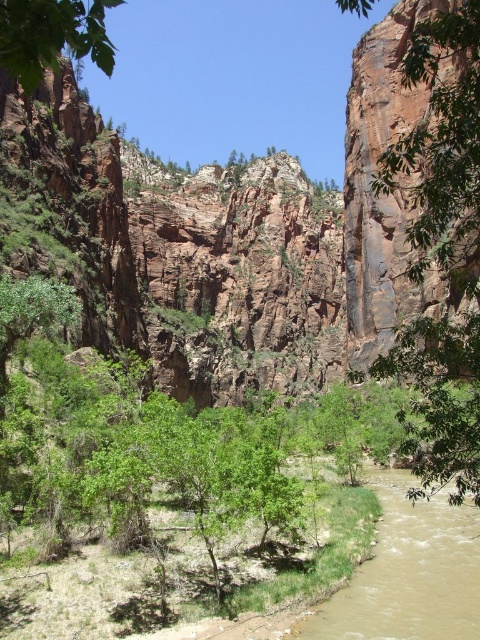
Is point (472, 358) farther from viewer compared to point (375, 592)?

That is False.

Can you confirm if green leafy tree at right is positioned to the right of brown muddy water at lower center?

Yes, green leafy tree at right is to the right of brown muddy water at lower center.

Is point (447, 234) farther from camera compared to point (397, 568)?

Yes, point (447, 234) is behind point (397, 568).

At what (x,y) coordinates should I click in order to perform the action: click on green leafy tree at right. Please return your answer as a coordinate pair (x, y). Looking at the image, I should click on (442, 252).

Is green leafy tree at right shorter than green leafy tree at upper left?

Correct, green leafy tree at right is not as tall as green leafy tree at upper left.

Where is `green leafy tree at right`? The image size is (480, 640). green leafy tree at right is located at coordinates (442, 252).

Which of these two, brown muddy water at lower center or green leafy tree at upper left, stands shorter?

With less height is brown muddy water at lower center.

This screenshot has width=480, height=640. What are the coordinates of `brown muddy water at lower center` in the screenshot? It's located at (408, 572).